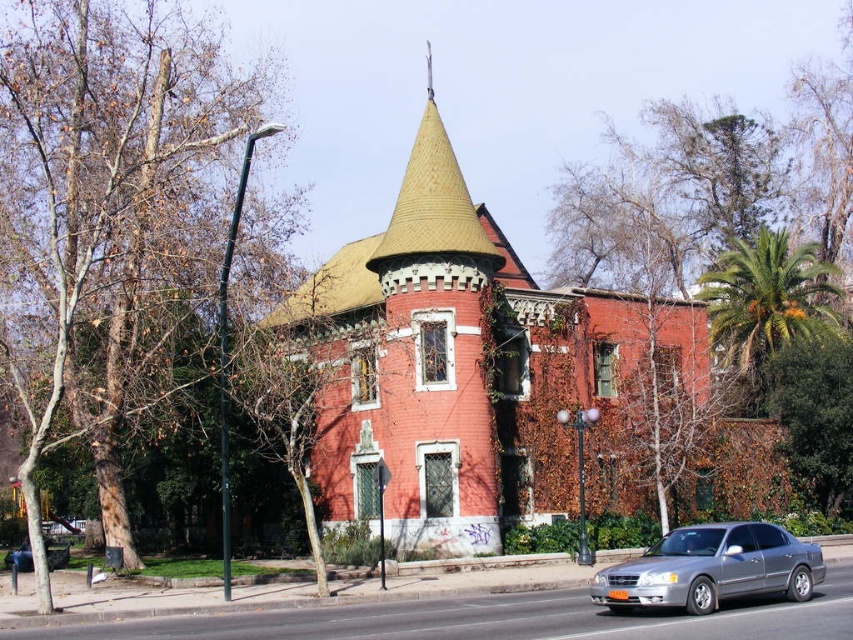
You are a delivery driver who needs to park your metallic silver sedan at center close to the yellow shingled spire at upper center. Given that the spire is larger than the car, can you estimate how much space you need to leave between them to ensure safety?

The yellow shingled spire at upper center is larger than the metallic silver sedan at center, so you should leave enough space between them to accommodate the spire size. However, since the spire is a fixed structure, you should park the metallic silver sedan at center at a safe distance from it without obstructing the spire.